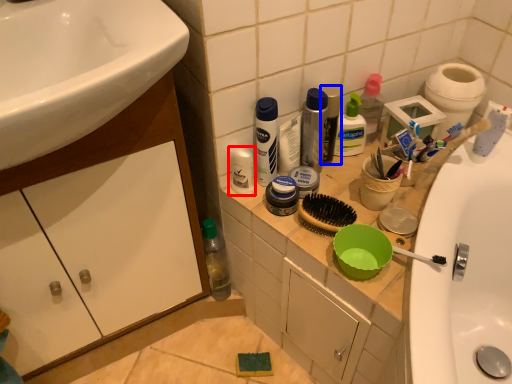
Question: Among these objects, which one is farthest to the camera, toiletry (highlighted by a red box) or mouthwash (highlighted by a blue box)?

Choices:
 (A) toiletry
 (B) mouthwash

Answer: (B)